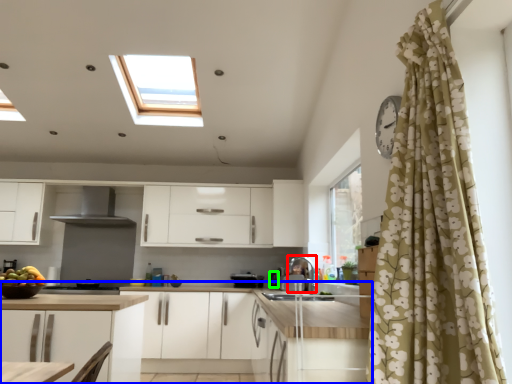
Question: Based on their relative distances, which object is nearer to appliance (highlighted by a red box)? Choose from countertop (highlighted by a blue box) and appliance (highlighted by a green box).

Choices:
 (A) countertop
 (B) appliance

Answer: (B)